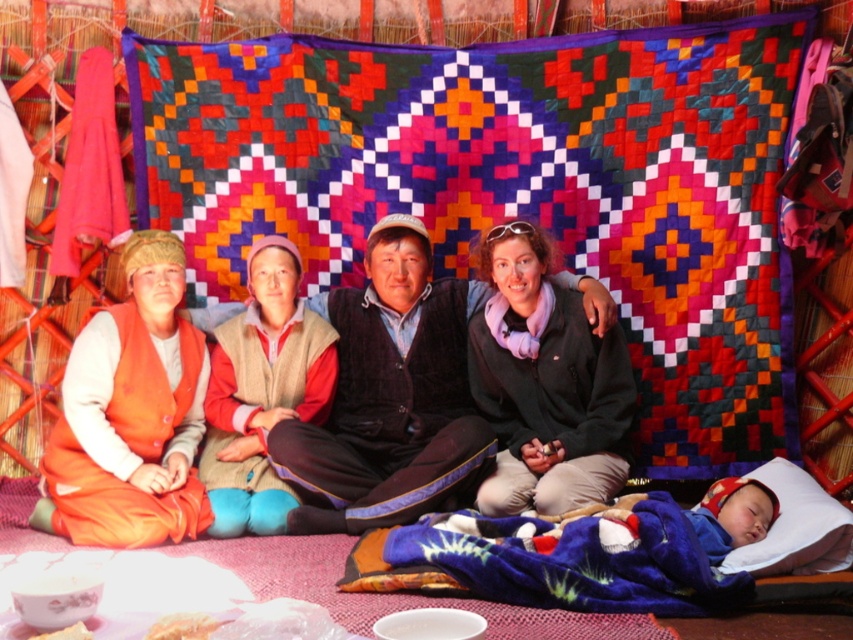
You are a photographer standing in the yurt and want to take a photo of the orange suede vest at left and the blue plush baby at lower right in the same frame. The camera you have can only capture objects within a 5 feet range. Will both subjects be in the frame?

The orange suede vest at left and blue plush baby at lower right are 5.45 feet apart, which exceeds the camera range of 5 feet. Therefore, both subjects cannot be captured in the same frame.

You are a guest in the yurt and want to place a small gift on the knitted wool sweater at center without covering the blue plush baby at lower right. Is there enough space?

→ The knitted wool sweater at center is bigger than blue plush baby at lower right, so there is enough space to place the small gift on the knitted wool sweater at center without covering the blue plush baby at lower right.

You are standing at the entrance of the yurt and want to hand a gift to the person wearing the orange suede vest at left. Based on the coordinates provided, in which general direction should you move to reach their location?

The orange suede vest at left is located at coordinates point (131,416). Since the yurt entrance is typically at the bottom of the image, moving towards the upper right direction would lead you to the orange suede vest at left.